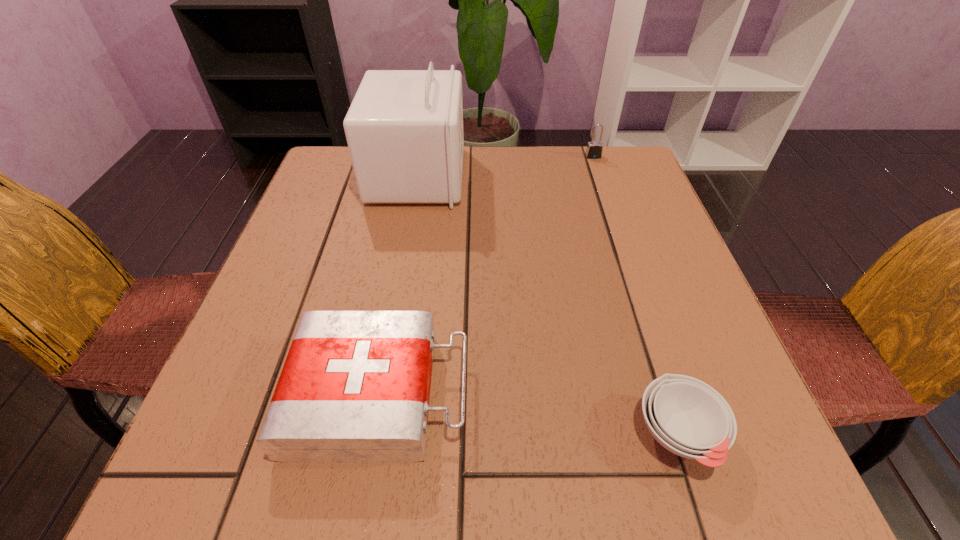
In order to click on the first-aid kit that is at the far edge in this screenshot , I will do `click(404, 129)`.

Locate an element on the screen. The height and width of the screenshot is (540, 960). padlock that is at the far edge is located at coordinates (594, 149).

At what (x,y) coordinates should I click in order to perform the action: click on the first-aid kit located at the near edge. Please return your answer as a coordinate pair (x, y). The width and height of the screenshot is (960, 540). Looking at the image, I should click on (355, 387).

At what (x,y) coordinates should I click in order to perform the action: click on soup bowl that is at the near edge. Please return your answer as a coordinate pair (x, y). The image size is (960, 540). Looking at the image, I should click on (689, 418).

Where is `padlock located at the right edge`? The image size is (960, 540). padlock located at the right edge is located at coordinates (594, 149).

This screenshot has height=540, width=960. In order to click on soup bowl that is positioned at the right edge in this screenshot , I will do `click(689, 418)`.

At what (x,y) coordinates should I click in order to perform the action: click on object that is at the far left corner. Please return your answer as a coordinate pair (x, y). Image resolution: width=960 pixels, height=540 pixels. Looking at the image, I should click on (404, 129).

Find the location of `object present at the near left corner`. object present at the near left corner is located at coordinates (355, 387).

The width and height of the screenshot is (960, 540). In order to click on object that is at the far right corner in this screenshot , I will do `click(594, 149)`.

Where is `object present at the near right corner`? object present at the near right corner is located at coordinates (689, 418).